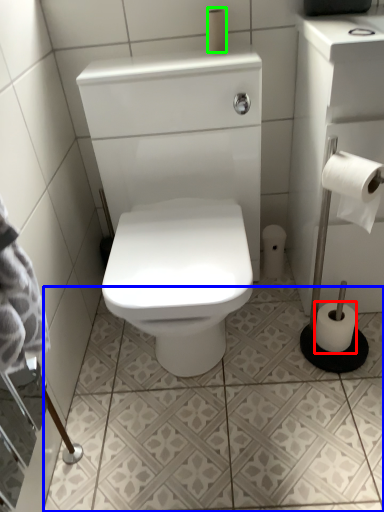
Question: Estimate the real-world distances between objects in this image. Which object is closer to toilet paper (highlighted by a red box), ceramic tile (highlighted by a blue box) or toilet paper (highlighted by a green box)?

Choices:
 (A) ceramic tile
 (B) toilet paper

Answer: (A)